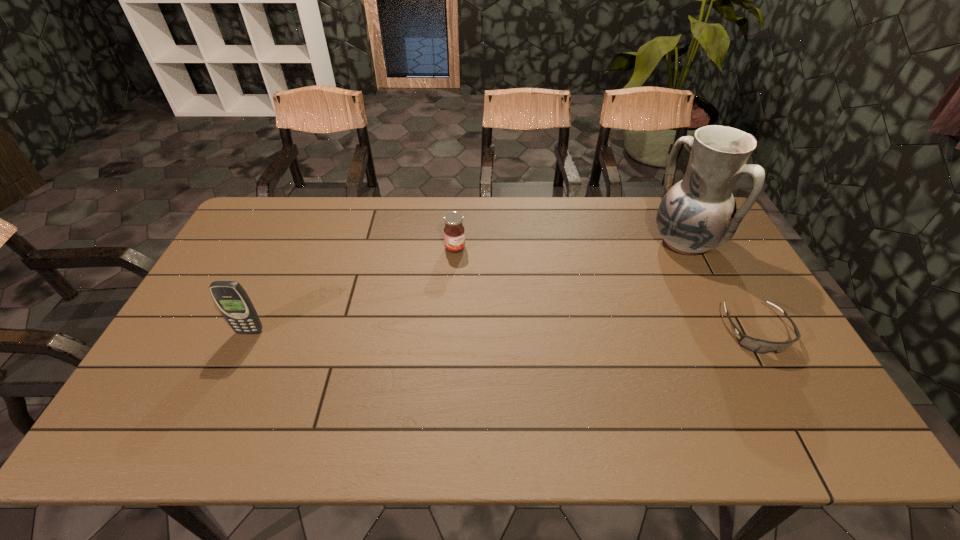
At what (x,y) coordinates should I click in order to perform the action: click on free spot on the desktop that is between the cellular telephone and the goggles and is positioned on the label side of the third object from right to left. Please return your answer as a coordinate pair (x, y). The width and height of the screenshot is (960, 540). Looking at the image, I should click on (522, 331).

Find the location of `vacant spot on the desktop that is between the second tallest object and the goggles and is positioned on the front-facing side of the tallest object`. vacant spot on the desktop that is between the second tallest object and the goggles and is positioned on the front-facing side of the tallest object is located at coordinates (553, 331).